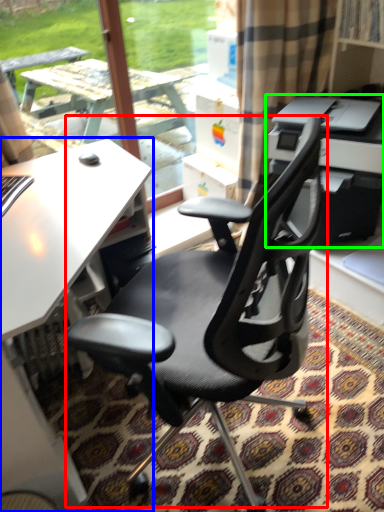
Question: Estimate the real-world distances between objects in this image. Which object is farther from chair (highlighted by a red box), desk (highlighted by a blue box) or printer (highlighted by a green box)?

Choices:
 (A) desk
 (B) printer

Answer: (B)